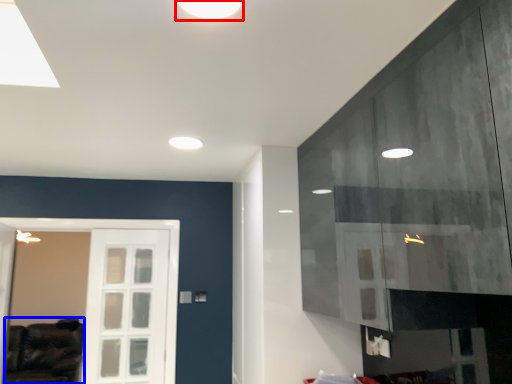
Question: Which of the following is the farthest to the observer, lighting (highlighted by a red box) or furniture (highlighted by a blue box)?

Choices:
 (A) lighting
 (B) furniture

Answer: (B)